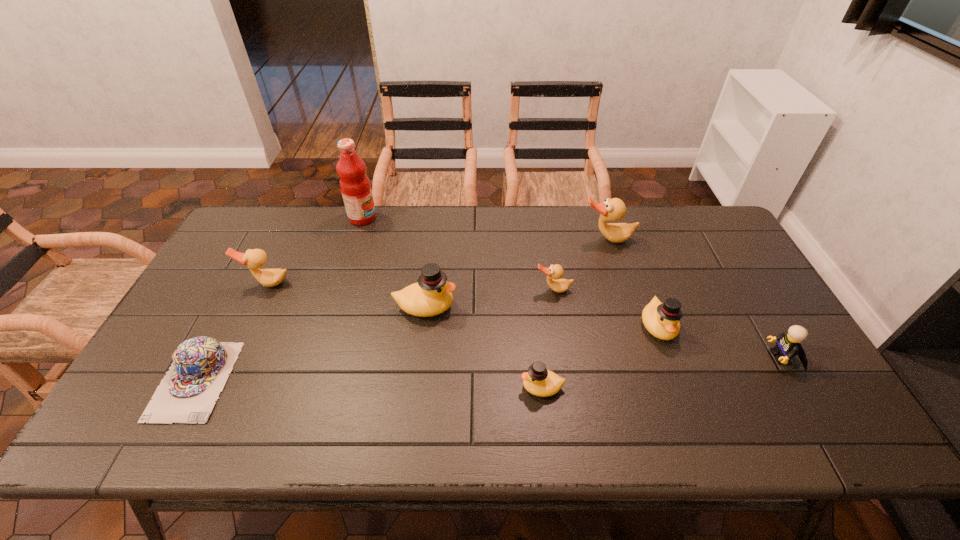
Locate an element on the screen. The height and width of the screenshot is (540, 960). empty location between the biggest yellow duck and the second biggest tan duck is located at coordinates (347, 295).

Locate an element on the screen. The height and width of the screenshot is (540, 960). vacant region between the tallest object and the leftmost duck is located at coordinates tap(315, 251).

You are a GUI agent. You are given a task and a screenshot of the screen. Output one action in this format:
    pyautogui.click(x=<x>, y=<y>)
    Task: Click on the blank region between the leftmost yellow duck and the nearest yellow duck
    The image size is (960, 540).
    Given the screenshot: What is the action you would take?
    pyautogui.click(x=484, y=347)

Locate an element on the screen. The image size is (960, 540). free spot between the farthest tan duck and the biggest yellow duck is located at coordinates (516, 273).

You are a GUI agent. You are given a task and a screenshot of the screen. Output one action in this format:
    pyautogui.click(x=<x>, y=<y>)
    Task: Click on the unoccupied position between the tallest object and the rightmost yellow duck
    The width and height of the screenshot is (960, 540).
    Given the screenshot: What is the action you would take?
    pyautogui.click(x=510, y=272)

Locate an element on the screen. Image resolution: width=960 pixels, height=540 pixels. free space between the farthest duck and the third object from left to right is located at coordinates click(485, 228).

Locate an element on the screen. The width and height of the screenshot is (960, 540). object that is the fourth closest to the rightmost object is located at coordinates (539, 381).

At what (x,y) coordinates should I click in order to perform the action: click on the sixth closest object to the Lego. Please return your answer as a coordinate pair (x, y). The image size is (960, 540). Looking at the image, I should click on (355, 186).

Locate which duck ranks third in proximity to the fruit juice. Please provide its 2D coordinates. Your answer should be formatted as a tuple, i.e. [(x, y)], where the tuple contains the x and y coordinates of a point satisfying the conditions above.

[(554, 272)]

Identify the location of duck that stands as the fourth closest to the biggest tan duck. The width and height of the screenshot is (960, 540). (539, 381).